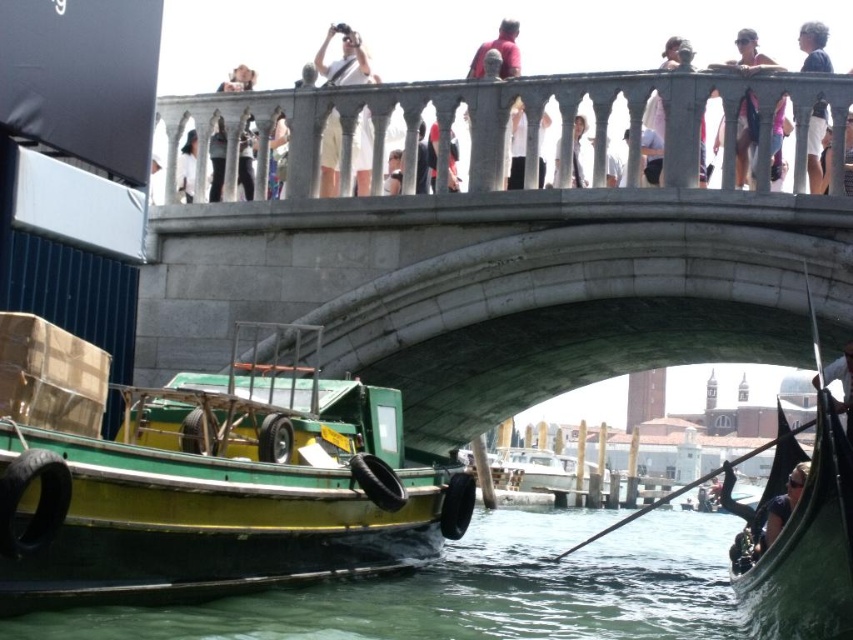
Is light gray stone railing at upper center wider than white glossy paddle at lower right?

Yes.

Can you confirm if light gray stone railing at upper center is thinner than white glossy paddle at lower right?

No.

Does point (833, 10) come closer to viewer compared to point (848, 387)?

No, (833, 10) is behind (848, 387).

This screenshot has width=853, height=640. Find the location of `light gray stone railing at upper center`. light gray stone railing at upper center is located at coordinates (331, 44).

Describe the element at coordinates (502, 257) in the screenshot. The height and width of the screenshot is (640, 853). I see `gray stone bridge at upper center` at that location.

Does gray stone bridge at upper center have a lesser width compared to light blue denim shorts at upper right?

Incorrect, gray stone bridge at upper center's width is not less than light blue denim shorts at upper right's.

Is point (677, 196) closer to viewer compared to point (816, 163)?

Yes, it is in front of point (816, 163).

Where is `gray stone bridge at upper center`? The image size is (853, 640). gray stone bridge at upper center is located at coordinates (502, 257).

Is green rubber boat at lower left below light gray stone railing at upper center?

Correct, green rubber boat at lower left is located below light gray stone railing at upper center.

Can you confirm if green rubber boat at lower left is positioned above light gray stone railing at upper center?

Actually, green rubber boat at lower left is below light gray stone railing at upper center.

Measure the distance between green rubber boat at lower left and camera.

green rubber boat at lower left is 48.57 meters away from camera.

Where is `green rubber boat at lower left`? green rubber boat at lower left is located at coordinates (474, 589).